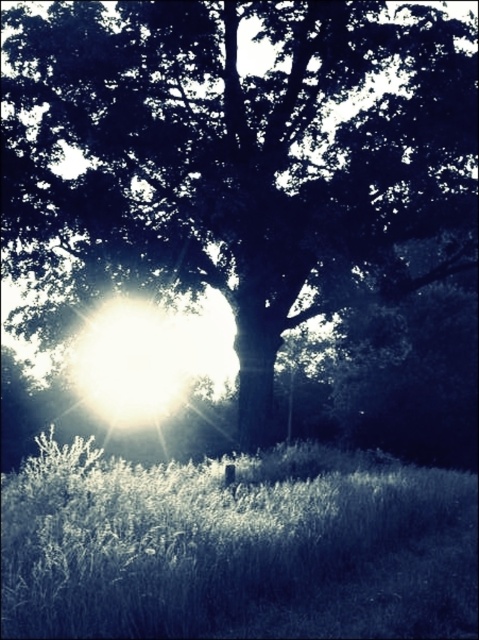
You are standing in the field of tall grasses in the foreground of the image. You want to walk directly towards the dark green leafy tree at center. Which direction should you head?

Since the dark green leafy tree at center is located at point 0.245 on the x axis and 0.495 on the y axis, you should head towards the center of the image to reach it.

You are standing in the field looking at the dark green leafy tree at center and the white soft grass at lower center. Which object is positioned higher in the scene?

The dark green leafy tree at center is positioned higher than the white soft grass at lower center.